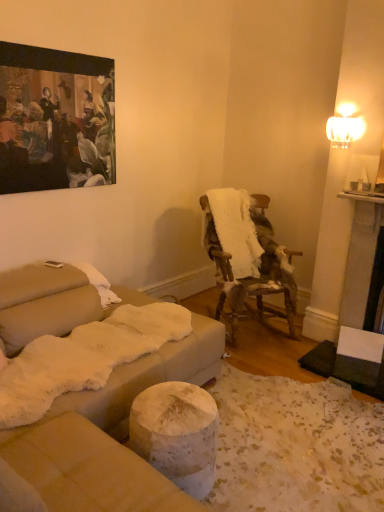
Question: Is white fluffy blanket at center-right taller than oil painting at upper left?

Choices:
 (A) yes
 (B) no

Answer: (B)

Question: From a real-world perspective, is white fluffy blanket at center-right located beneath oil painting at upper left?

Choices:
 (A) yes
 (B) no

Answer: (A)

Question: Is white fluffy blanket at center-right looking in the opposite direction of oil painting at upper left?

Choices:
 (A) yes
 (B) no

Answer: (B)

Question: Is white fluffy blanket at center-right far from oil painting at upper left?

Choices:
 (A) no
 (B) yes

Answer: (B)

Question: Can you confirm if white fluffy blanket at center-right is smaller than oil painting at upper left?

Choices:
 (A) yes
 (B) no

Answer: (B)

Question: Is white fluffy blanket at center-right in front of or behind fur-covered wooden chair at center-right in the image?

Choices:
 (A) front
 (B) behind

Answer: (B)

Question: Is white fluffy blanket at center-right taller or shorter than fur-covered wooden chair at center-right?

Choices:
 (A) tall
 (B) short

Answer: (B)

Question: Considering the positions of white fluffy blanket at center-right and fur-covered wooden chair at center-right in the image, is white fluffy blanket at center-right wider or thinner than fur-covered wooden chair at center-right?

Choices:
 (A) wide
 (B) thin

Answer: (B)

Question: Is white fluffy blanket at center-right bigger or smaller than fur-covered wooden chair at center-right?

Choices:
 (A) small
 (B) big

Answer: (A)

Question: From a real-world perspective, is fur-covered wooden chair at center-right above or below oil painting at upper left?

Choices:
 (A) below
 (B) above

Answer: (A)

Question: Based on their sizes in the image, would you say fur-covered wooden chair at center-right is bigger or smaller than oil painting at upper left?

Choices:
 (A) big
 (B) small

Answer: (A)

Question: From the image's perspective, is fur-covered wooden chair at center-right positioned above or below oil painting at upper left?

Choices:
 (A) below
 (B) above

Answer: (A)

Question: In the image, is fur-covered wooden chair at center-right positioned in front of or behind oil painting at upper left?

Choices:
 (A) behind
 (B) front

Answer: (A)

Question: Is point (96, 144) closer or farther from the camera than point (223, 269)?

Choices:
 (A) closer
 (B) farther

Answer: (A)

Question: Looking at their shapes, would you say oil painting at upper left is wider or thinner than fur-covered wooden chair at center-right?

Choices:
 (A) wide
 (B) thin

Answer: (B)